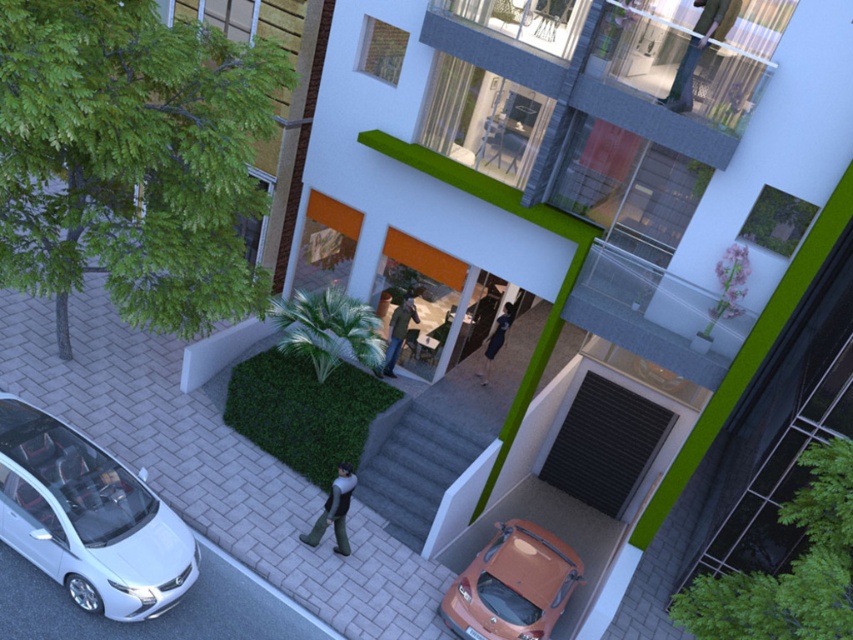
Question: Considering the relative positions of matte orange car at lower center and dark green textured jacket at center in the image provided, where is matte orange car at lower center located with respect to dark green textured jacket at center?

Choices:
 (A) right
 (B) left

Answer: (A)

Question: Which of the following is the closest to the observer?

Choices:
 (A) dark blue dress at center
 (B) white glossy hatchback at lower left
 (C) green fabric jacket at upper center

Answer: (B)

Question: Is dark gray fabric pants at lower center above dark blue dress at center?

Choices:
 (A) no
 (B) yes

Answer: (A)

Question: Among these points, which one is farthest from the camera?

Choices:
 (A) (318, 534)
 (B) (547, 586)
 (C) (480, 380)
 (D) (177, 600)

Answer: (C)

Question: Does matte orange car at lower center appear on the left side of dark blue dress at center?

Choices:
 (A) no
 (B) yes

Answer: (B)

Question: Which object is positioned closest to the green fabric jacket at upper center?

Choices:
 (A) dark green textured jacket at center
 (B) dark blue dress at center
 (C) dark gray fabric pants at lower center

Answer: (A)